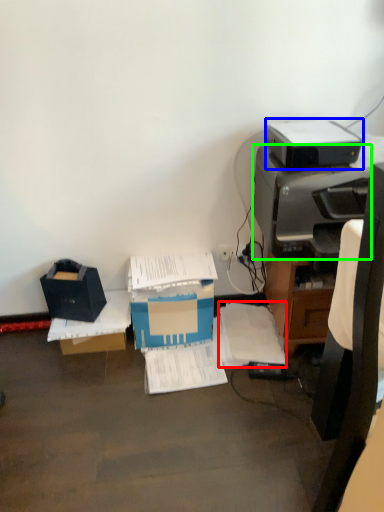
Question: Based on their relative distances, which object is farther from document (highlighted by a red box)? Choose from printer (highlighted by a blue box) and printer (highlighted by a green box).

Choices:
 (A) printer
 (B) printer

Answer: (A)